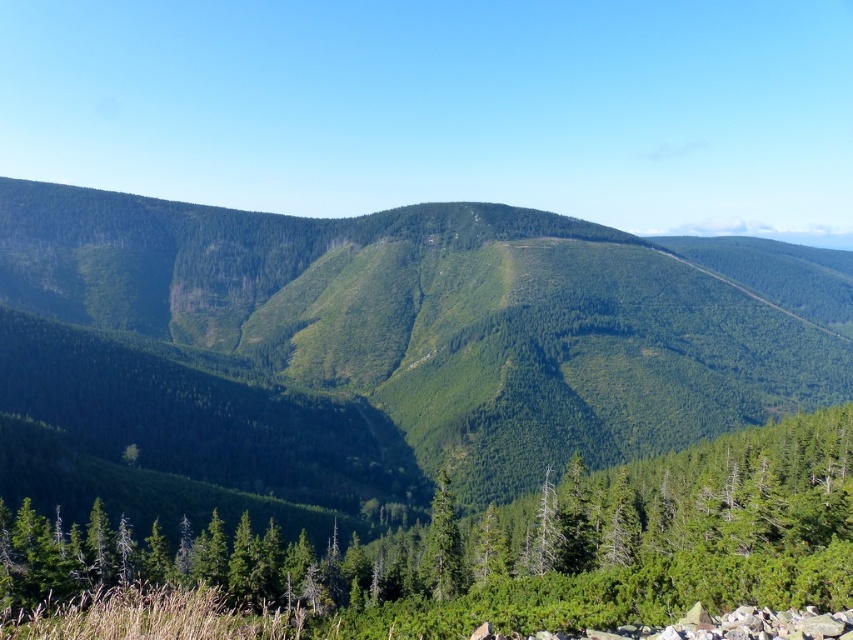
Question: Is green forested mountain at center thinner than green matte tree at center?

Choices:
 (A) no
 (B) yes

Answer: (A)

Question: Which object is positioned farthest from the green matte tree at center?

Choices:
 (A) green matte tree at lower center
 (B) green forested mountain at center

Answer: (B)

Question: Can you confirm if green forested mountain at center is positioned to the left of green matte tree at lower center?

Choices:
 (A) yes
 (B) no

Answer: (B)

Question: Estimate the real-world distances between objects in this image. Which object is closer to the green matte tree at lower center?

Choices:
 (A) green matte tree at center
 (B) green forested mountain at center

Answer: (A)

Question: Can you confirm if green forested mountain at center is positioned to the right of green matte tree at lower center?

Choices:
 (A) no
 (B) yes

Answer: (B)

Question: Which of these objects is positioned closest to the green matte tree at lower center?

Choices:
 (A) green matte tree at center
 (B) green forested mountain at center

Answer: (A)